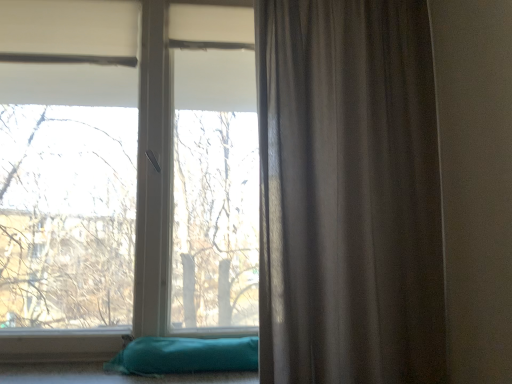
Question: Does transparent glass window at center have a greater width compared to satin gray curtain at right?

Choices:
 (A) yes
 (B) no

Answer: (B)

Question: Does transparent glass window at center have a smaller size compared to satin gray curtain at right?

Choices:
 (A) yes
 (B) no

Answer: (B)

Question: Does transparent glass window at center lie behind satin gray curtain at right?

Choices:
 (A) yes
 (B) no

Answer: (A)

Question: From the image's perspective, is transparent glass window at center on satin gray curtain at right?

Choices:
 (A) no
 (B) yes

Answer: (B)

Question: Can you confirm if transparent glass window at center is bigger than satin gray curtain at right?

Choices:
 (A) no
 (B) yes

Answer: (B)

Question: Looking at their shapes, would you say transparent glass window at center is wider or thinner than satin gray curtain at right?

Choices:
 (A) wide
 (B) thin

Answer: (B)

Question: In terms of size, does transparent glass window at center appear bigger or smaller than satin gray curtain at right?

Choices:
 (A) big
 (B) small

Answer: (A)

Question: Is point (122, 326) positioned closer to the camera than point (295, 206)?

Choices:
 (A) farther
 (B) closer

Answer: (A)

Question: Based on their positions, is transparent glass window at center located to the left or right of satin gray curtain at right?

Choices:
 (A) right
 (B) left

Answer: (B)

Question: In terms of size, does transparent glass window at center appear bigger or smaller than teal fabric pillow at lower left?

Choices:
 (A) big
 (B) small

Answer: (A)

Question: From the image's perspective, is transparent glass window at center positioned above or below teal fabric pillow at lower left?

Choices:
 (A) below
 (B) above

Answer: (B)

Question: Is transparent glass window at center in front of or behind teal fabric pillow at lower left in the image?

Choices:
 (A) behind
 (B) front

Answer: (A)

Question: Considering the positions of transparent glass window at center and teal fabric pillow at lower left in the image, is transparent glass window at center taller or shorter than teal fabric pillow at lower left?

Choices:
 (A) short
 (B) tall

Answer: (B)

Question: Is satin gray curtain at right in front of or behind teal fabric pillow at lower left in the image?

Choices:
 (A) front
 (B) behind

Answer: (A)

Question: In terms of height, does satin gray curtain at right look taller or shorter compared to teal fabric pillow at lower left?

Choices:
 (A) short
 (B) tall

Answer: (B)